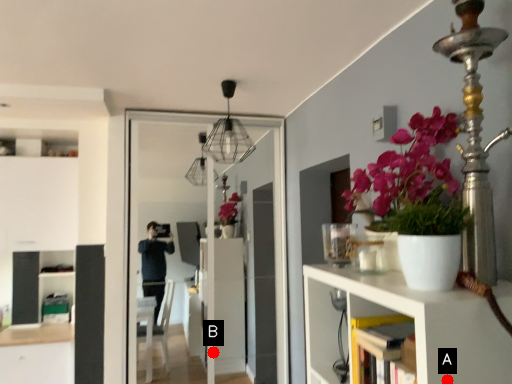
Question: Two points are circled on the image, labeled by A and B beside each circle. Which of the following is the closest to the observer?

Choices:
 (A) A is closer
 (B) B is closer

Answer: (A)